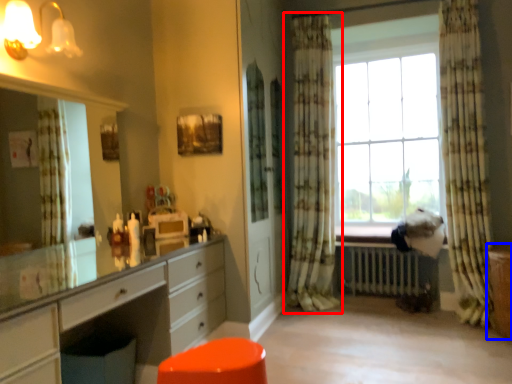
Question: Which point is closer to the camera, curtain (highlighted by a red box) or file cabinet (highlighted by a blue box)?

Choices:
 (A) curtain
 (B) file cabinet

Answer: (B)